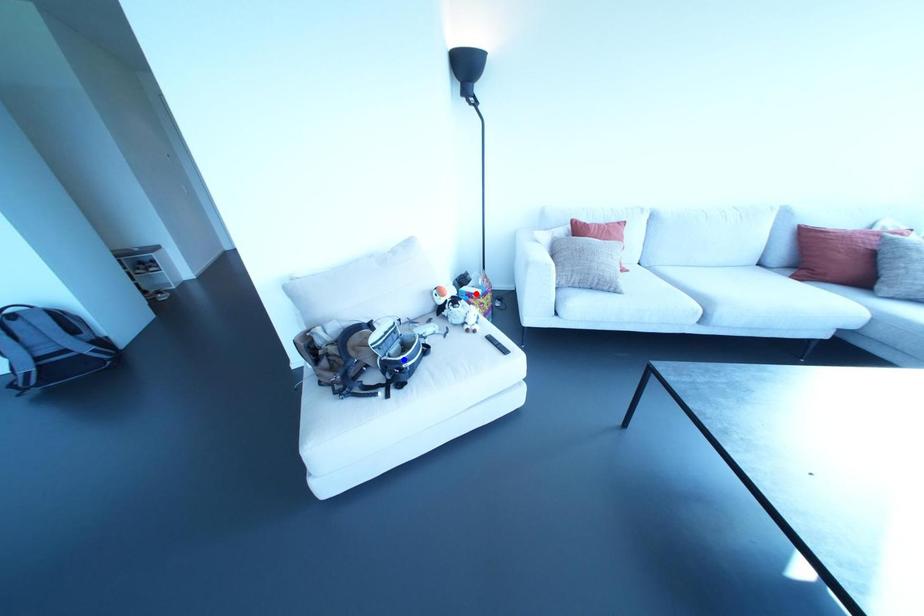
Question: Which of the two points in the image is closer to the camera?

Choices:
 (A) Blue point is closer.
 (B) Red point is closer.

Answer: (A)